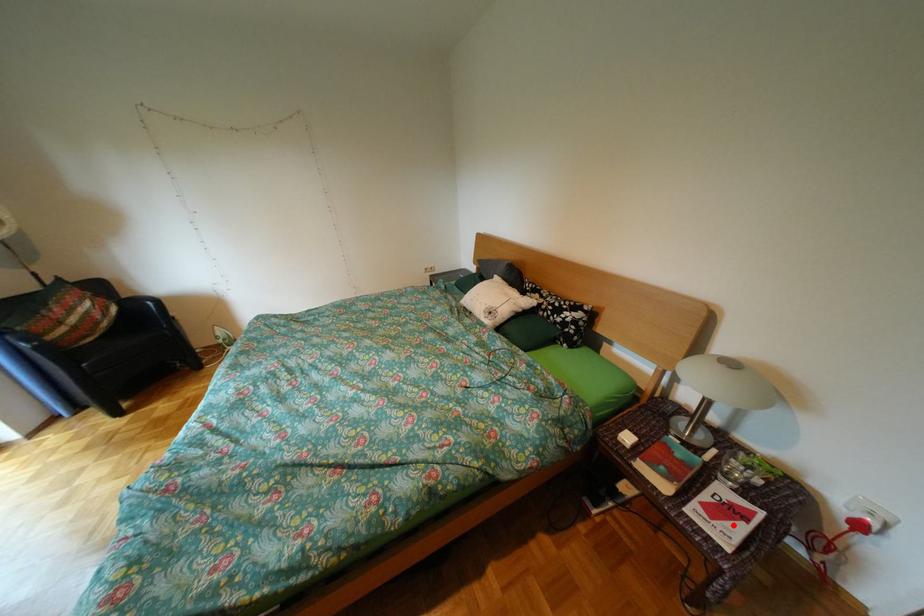
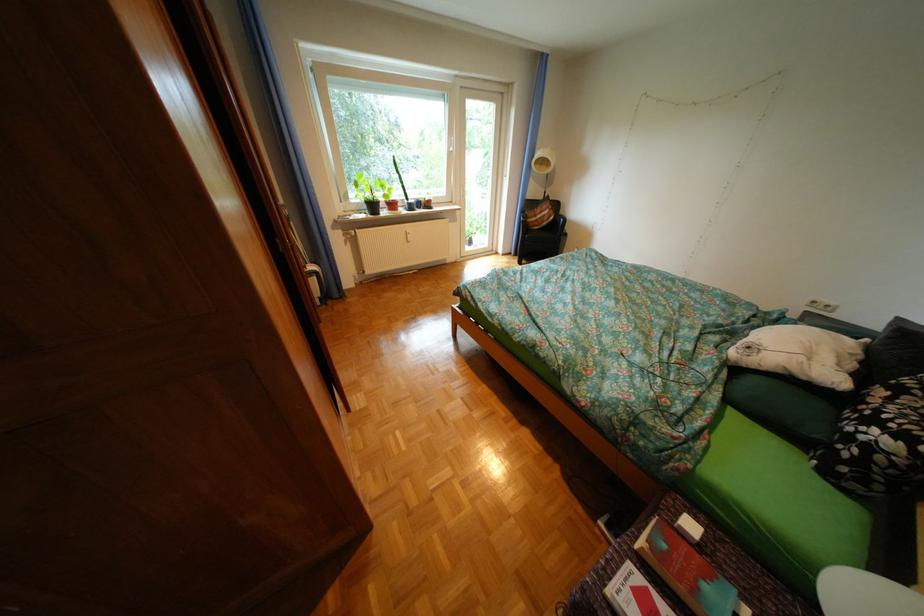
The point at the highlighted location is marked in the first image. Where is the corresponding point in the second image?

(642, 592)